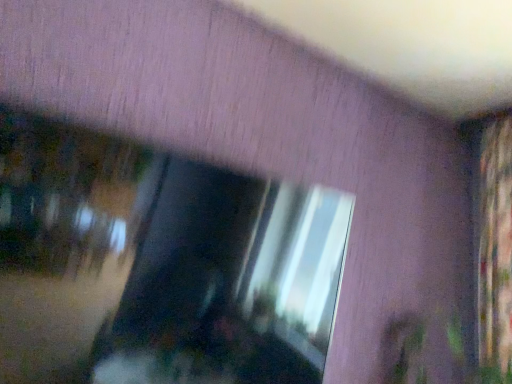
The image size is (512, 384). What do you see at coordinates (158, 265) in the screenshot?
I see `glossy reflective mirror at upper center` at bounding box center [158, 265].

In order to click on glossy reflective mirror at upper center in this screenshot , I will do `click(158, 265)`.

Find the location of a particular element. glossy reflective mirror at upper center is located at coordinates (158, 265).